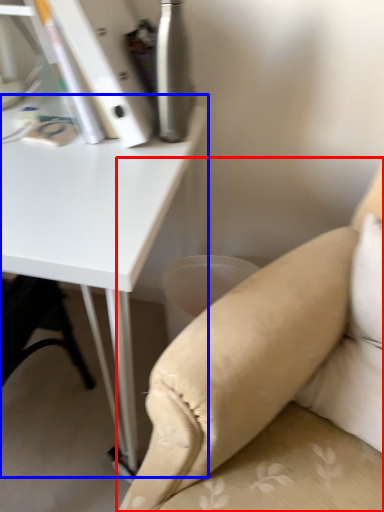
Question: Which object appears farthest to the camera in this image, studio couch (highlighted by a red box) or table (highlighted by a blue box)?

Choices:
 (A) studio couch
 (B) table

Answer: (B)